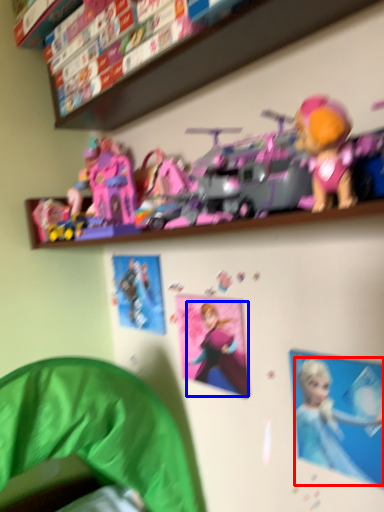
Question: Which point is further to the camera, person (highlighted by a red box) or toy (highlighted by a blue box)?

Choices:
 (A) person
 (B) toy

Answer: (B)